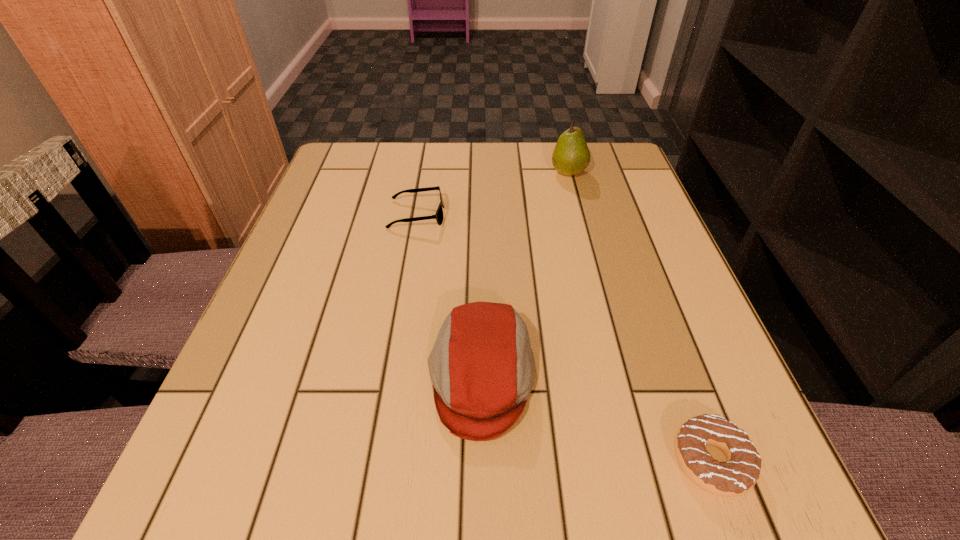
Where is `the farthest object`? the farthest object is located at coordinates (571, 156).

I want to click on pear, so click(x=571, y=156).

The height and width of the screenshot is (540, 960). I want to click on cap, so click(x=482, y=367).

At what (x,y) coordinates should I click in order to perform the action: click on sunglasses. Please return your answer as a coordinate pair (x, y). This screenshot has width=960, height=540. Looking at the image, I should click on (438, 216).

Where is `doughnut`? The height and width of the screenshot is (540, 960). doughnut is located at coordinates (737, 476).

This screenshot has height=540, width=960. What are the coordinates of `free location located 0.130m on the front of the pear` in the screenshot? It's located at (580, 215).

Where is `free region located on the front-facing side of the cap`? This screenshot has height=540, width=960. free region located on the front-facing side of the cap is located at coordinates (337, 377).

Identify the location of vacant region located on the front-facing side of the cap. (376, 377).

At what (x,y) coordinates should I click in order to perform the action: click on blank space located on the front-facing side of the cap. Please return your answer as a coordinate pair (x, y). This screenshot has width=960, height=540. Looking at the image, I should click on (228, 377).

This screenshot has width=960, height=540. What are the coordinates of `vacant area situated on the front-facing side of the sunglasses` in the screenshot? It's located at coord(579,215).